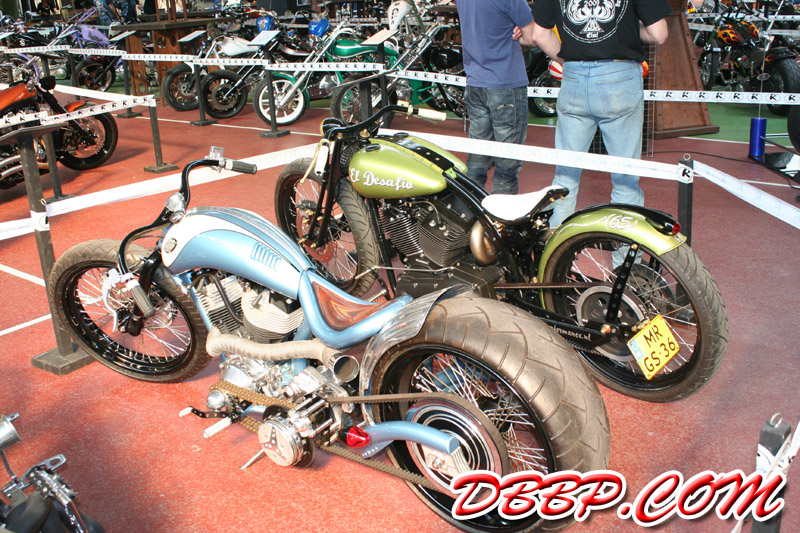
Locate an element on the screen. footrest is located at coordinates (221, 422).